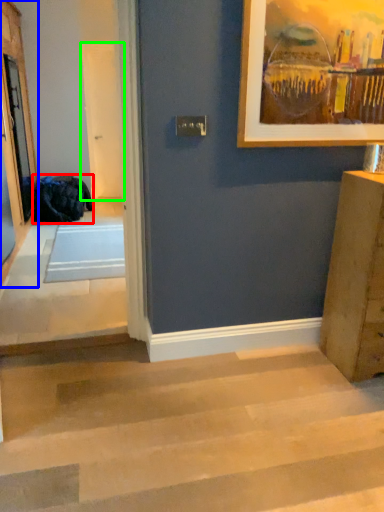
Question: Which object is positioned closest to laundry (highlighted by a red box)? Select from screen door (highlighted by a blue box) and screen door (highlighted by a green box).

Choices:
 (A) screen door
 (B) screen door

Answer: (A)